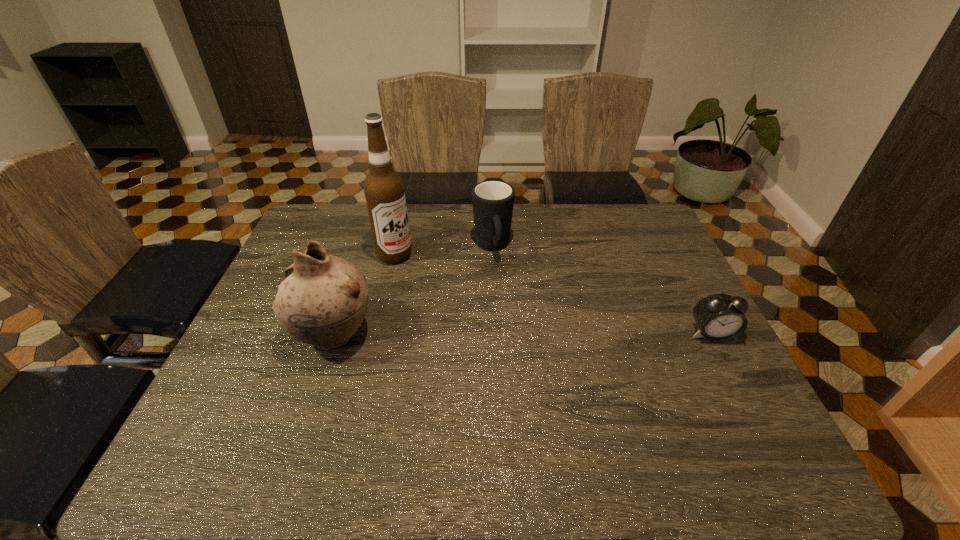
Find the location of a particular element. Image resolution: width=960 pixels, height=540 pixels. vacant space in between the mug and the shortest object is located at coordinates (602, 291).

Choose which object is the second nearest neighbor to the mug. Please provide its 2D coordinates. Your answer should be formatted as a tuple, i.e. [(x, y)], where the tuple contains the x and y coordinates of a point satisfying the conditions above.

[(322, 300)]

Identify the location of object that is the closest one to the pottery. (384, 190).